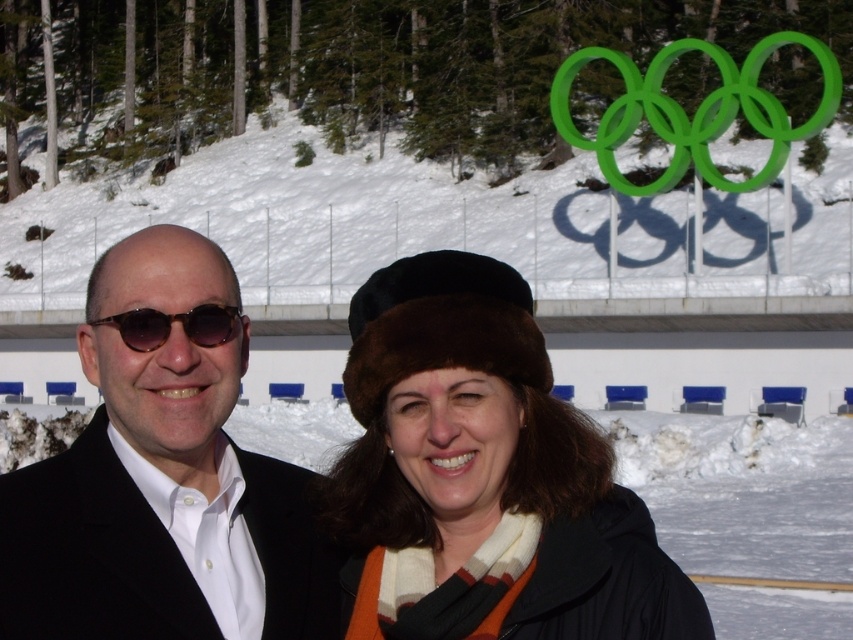
Question: Which object is farther from the camera taking this photo?

Choices:
 (A) brown fur hat at center
 (B) black matte suit at left
 (C) tortoiseshell plastic sunglasses at left

Answer: (C)

Question: Which of the following is the closest to the observer?

Choices:
 (A) (70, 589)
 (B) (190, 326)
 (C) (491, 608)

Answer: (A)

Question: Based on their relative distances, which object is nearer to the tortoiseshell plastic sunglasses at left?

Choices:
 (A) black matte suit at left
 (B) brown fur hat at center

Answer: (A)

Question: Does brown fur hat at center appear over tortoiseshell plastic sunglasses at left?

Choices:
 (A) yes
 (B) no

Answer: (B)

Question: Does brown fur hat at center lie in front of black matte suit at left?

Choices:
 (A) no
 (B) yes

Answer: (B)

Question: From the image, what is the correct spatial relationship of black matte suit at left in relation to tortoiseshell plastic sunglasses at left?

Choices:
 (A) left
 (B) right

Answer: (A)